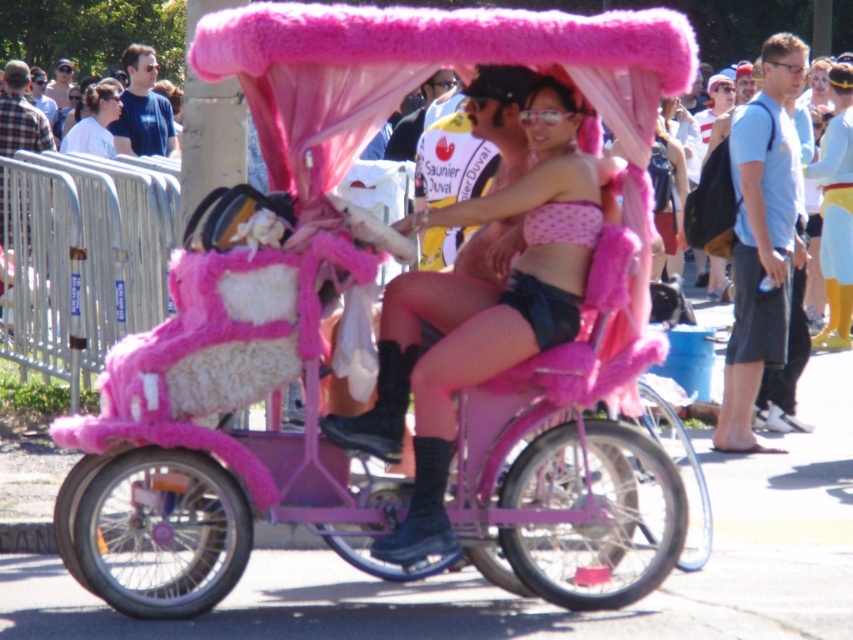
Question: Is blue fabric backpack at right below matte white shirt at upper left?

Choices:
 (A) yes
 (B) no

Answer: (A)

Question: Which point appears closest to the camera in this image?

Choices:
 (A) (97, 136)
 (B) (782, 205)

Answer: (B)

Question: Does matte pink fur coat at center have a smaller size compared to matte white shirt at upper left?

Choices:
 (A) yes
 (B) no

Answer: (B)

Question: Where is matte pink fur coat at center located in relation to blue fabric backpack at right in the image?

Choices:
 (A) left
 (B) right

Answer: (A)

Question: Which object is farther from the camera taking this photo?

Choices:
 (A) blue cotton shirt at upper left
 (B) blue fabric backpack at right
 (C) matte pink fur coat at center

Answer: (A)

Question: Which point is farther to the camera?

Choices:
 (A) matte white shirt at upper left
 (B) blue fabric backpack at right
 (C) blue cotton shirt at upper left

Answer: (C)